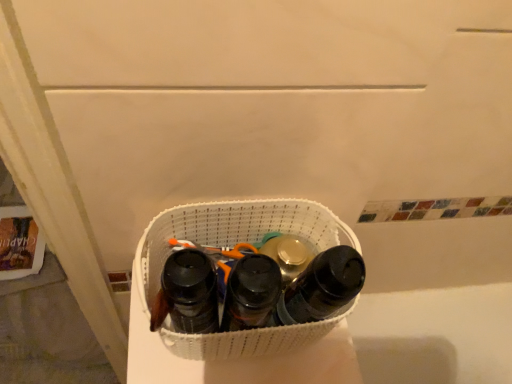
Question: Considering their positions, is black matte bottle at center, the first footwear in the right-to-left sequence, located in front of or behind white woven laundry basket at center?

Choices:
 (A) front
 (B) behind

Answer: (A)

Question: Would you say black matte bottle at center, the first footwear in the right-to-left sequence, is inside or outside white woven laundry basket at center?

Choices:
 (A) outside
 (B) inside

Answer: (B)

Question: Based on their relative distances, which object is farther from the black matte water bottle at center, the first footwear when ordered from left to right?

Choices:
 (A) white woven laundry basket at center
 (B) black matte bottle at center, the first footwear in the right-to-left sequence
 (C) black matte shoe at center, which is the second footwear in left-to-right order

Answer: (B)

Question: Which object is positioned closest to the black matte bottle at center, which is the 3th footwear from left to right?

Choices:
 (A) white woven laundry basket at center
 (B) black matte shoe at center, the 2th footwear viewed from the right
 (C) black matte water bottle at center, the first footwear when ordered from left to right

Answer: (B)